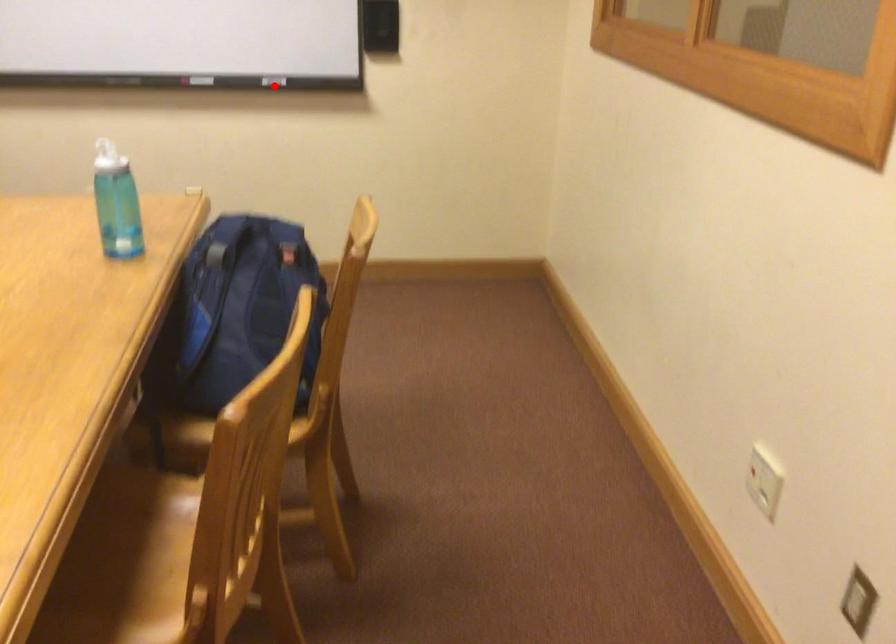
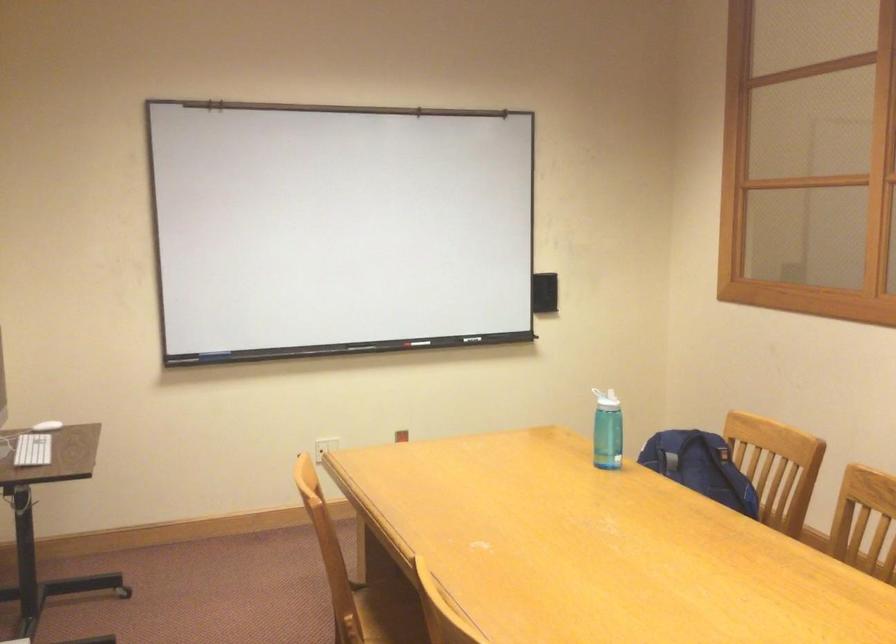
Find the pixel in the second image that matches the highlighted location in the first image.

(476, 339)